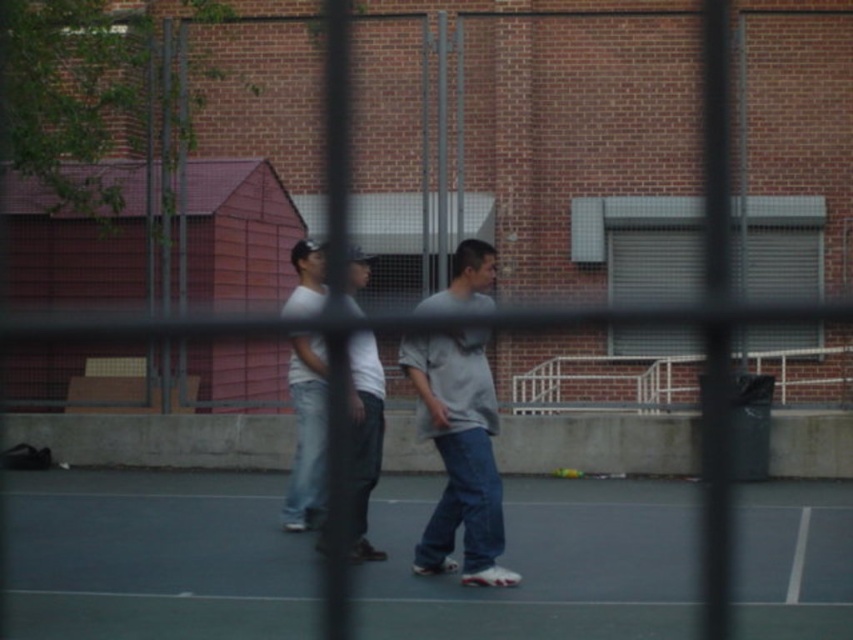
You are a photographer trying to capture a clear shot of the smooth gray court at center and the white matte shirt at center. Based on their positions, which object is closer to the camera?

The smooth gray court at center is closer to the camera because the white matte shirt at center is behind it.

You are standing on the basketball court and want to take a photo of both the point at [405,108] and the point at [689,576]. Which point should you focus on first to ensure both are in focus?

You should focus on the point at [405,108] first because it is closer to the camera than the point at [689,576]. By focusing on the closer point, the farther point will also be within the depth of field.